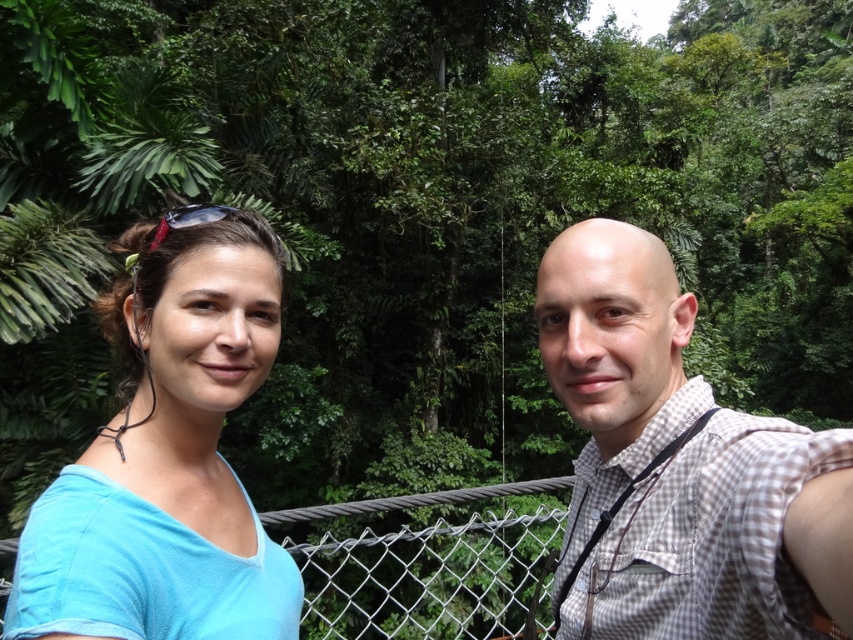
You are standing in a forest and see a point marked at coordinates (679, 467). According to the image, where is this point located?

The point marked at coordinates (679, 467) is located on the white checkered shirt at center.

You are a photographer trying to decide which shirt to recommend for a tight fitting outfit. Given the blue fabric shirt at left and the white checkered shirt at center, which one would you suggest based on their fit?

The blue fabric shirt at left is thinner than the white checkered shirt at center, so it would be more suitable for a tight fitting outfit.